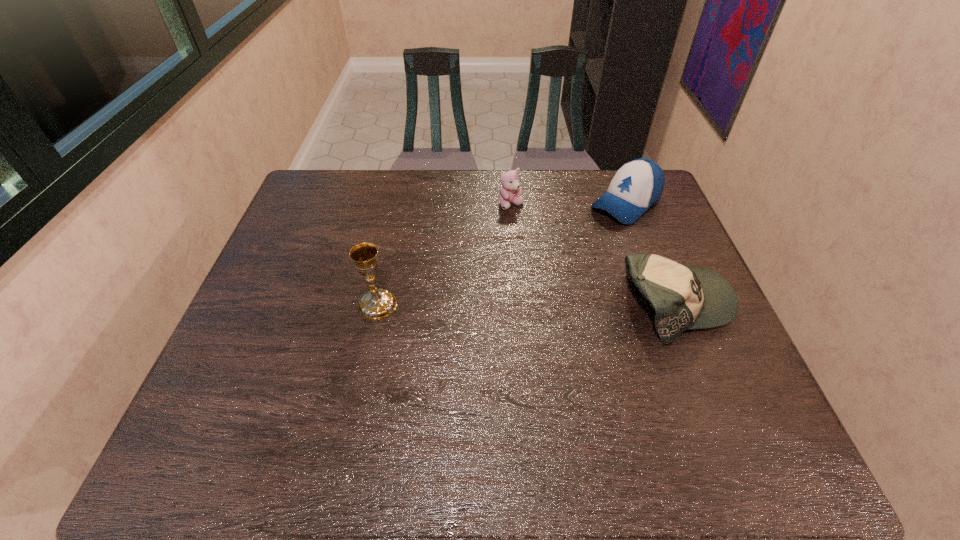
This screenshot has width=960, height=540. In order to click on free space on the desktop that is between the tallest object and the nearer baseball cap and is positioned on the front-facing side of the farther baseball cap in this screenshot , I will do `click(496, 305)`.

Where is `free space on the desktop that is between the tallest object and the shorter baseball cap and is positioned at the face of the second object from left to right`? The image size is (960, 540). free space on the desktop that is between the tallest object and the shorter baseball cap and is positioned at the face of the second object from left to right is located at coordinates (557, 305).